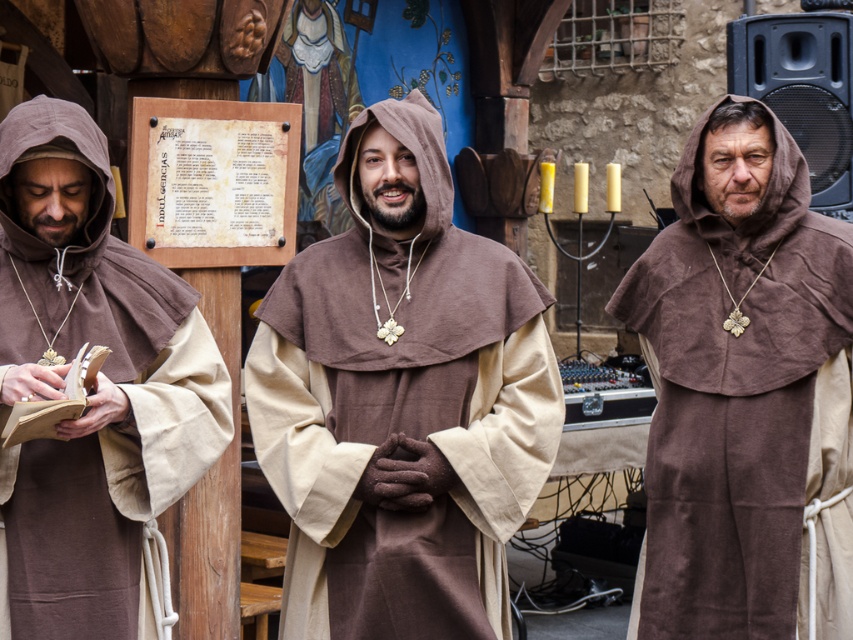
You are a tailor measuring two robes for alterations. You have a brown cotton robe at center and a brown cotton robe at left. Which robe requires a longer hem? Please explain based on their sizes.

The brown cotton robe at center requires a longer hem because it is much taller than the brown cotton robe at left.

You are a tailor observing the two robes in the image. The brown cotton robe at center and the brown linen robe at right. Which robe is positioned higher in the image?

The brown cotton robe at center is positioned higher than the brown linen robe at right.

You are designing a historical costume exhibit and need to display two robes from the image. The brown linen robe at right and the brown cotton robe at left must be arranged side by side. Which robe should be placed on the left side to maintain proper scale and visual balance?

The brown cotton robe at left should be placed on the left side because it is smaller in size compared to the brown linen robe at right, ensuring visual balance when displayed side by side.